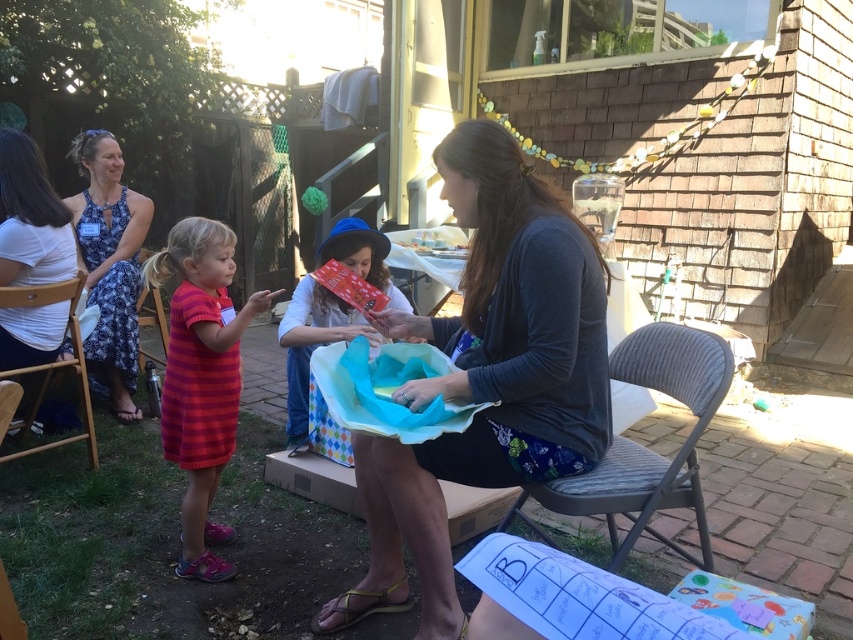
Question: Can you confirm if striped knit dress at left is positioned to the right of wooden folding chair at left?

Choices:
 (A) no
 (B) yes

Answer: (B)

Question: Is matte gray shirt at center bigger than wooden chair at lower left?

Choices:
 (A) no
 (B) yes

Answer: (B)

Question: Which point is farther to the camera?

Choices:
 (A) gray corduroy chair at center
 (B) white cotton shirt at left

Answer: (B)

Question: From the image, what is the correct spatial relationship of blue floral dress at left in relation to wooden folding chair at left?

Choices:
 (A) below
 (B) above

Answer: (B)

Question: Which point is closer to the camera taking this photo?

Choices:
 (A) (0, 355)
 (B) (32, 401)

Answer: (A)

Question: Which of these objects is positioned closest to the blue floral dress at left?

Choices:
 (A) matte gray shirt at center
 (B) gray corduroy chair at center
 (C) wooden folding chair at left
 (D) wooden chair at lower left

Answer: (D)